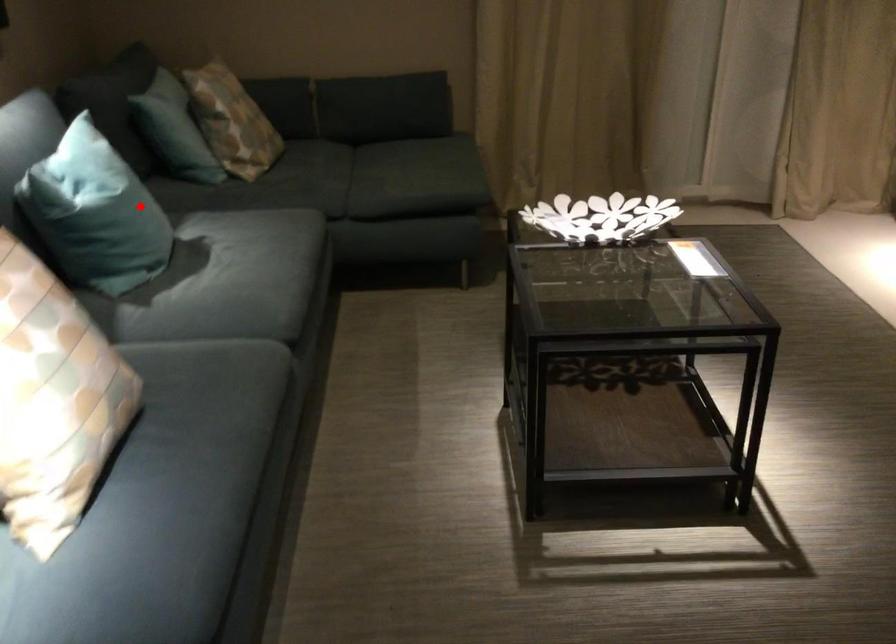
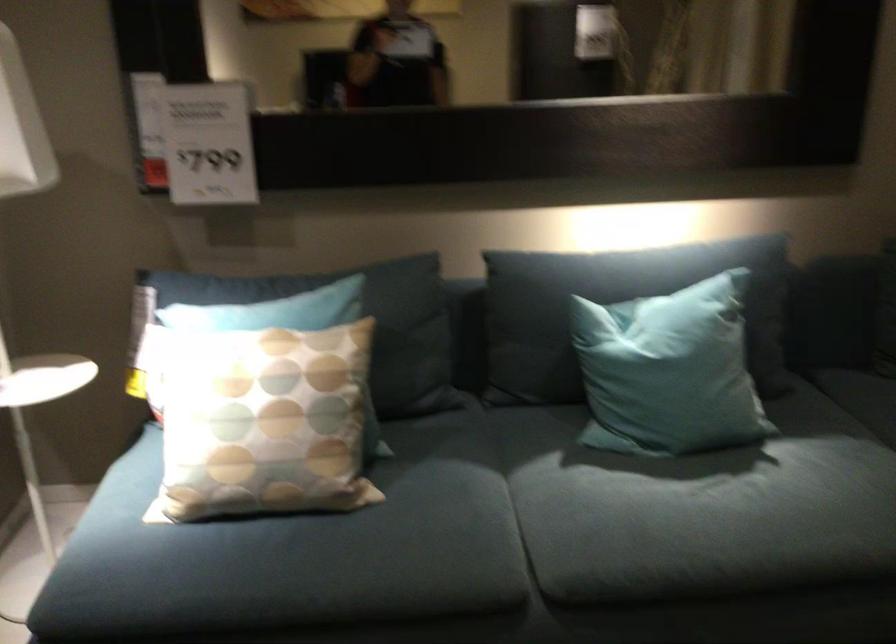
Where in the second image is the point corresponding to the highlighted location from the first image?

(668, 371)